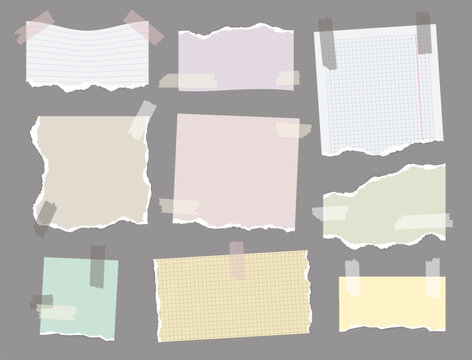
Locate an element on the screen. pieces of paper is located at coordinates (376, 200), (380, 82), (253, 54), (110, 65), (94, 155), (196, 169), (180, 289), (370, 303), (95, 303).